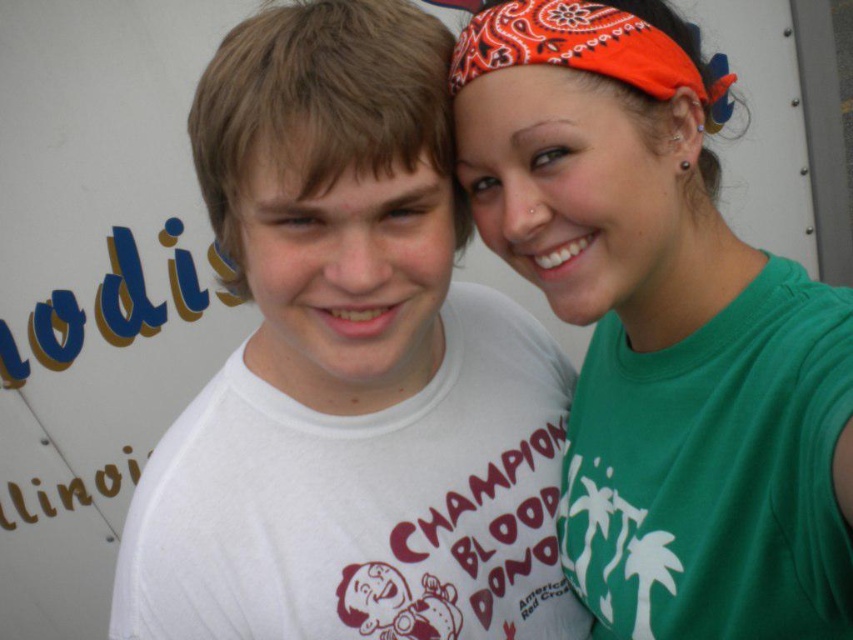
Which is behind, point (358, 33) or point (679, 70)?

The point (679, 70) is more distant.

The height and width of the screenshot is (640, 853). Identify the location of white matte t-shirt at center. (349, 369).

Who is shorter, white matte t-shirt at center or orange bandana at upper right?

orange bandana at upper right

Can you confirm if white matte t-shirt at center is thinner than orange bandana at upper right?

No.

Identify the location of white matte t-shirt at center. (349, 369).

Does point (602, 225) come farther from viewer compared to point (640, 67)?

Yes.

Is green matte t-shirt at upper right to the right of orange bandana at upper right from the viewer's perspective?

Correct, you'll find green matte t-shirt at upper right to the right of orange bandana at upper right.

At what (x,y) coordinates should I click in order to perform the action: click on green matte t-shirt at upper right. Please return your answer as a coordinate pair (x, y). Looking at the image, I should click on (662, 328).